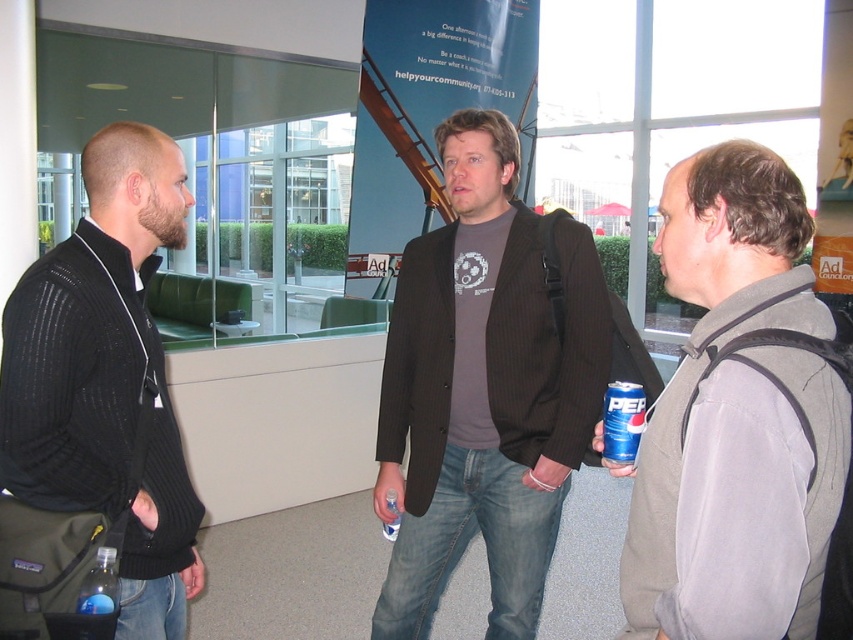
You are an observer in the scene. You notice the gray fleece vest at center and the dark brown pinstripe blazer at center. Which clothing item is positioned higher on the person?

The gray fleece vest at center is positioned higher than the dark brown pinstripe blazer at center.

You are a photographer trying to capture the blue metallic can at center right. You notice the gray fleece vest at center is blocking your view. Can you confirm if the vest is covering the can?

The gray fleece vest at center is positioned over the blue metallic can at center right, so yes, the vest is covering the can.

You are a photographer setting up a shoot in this scene. You need to ensure that the dark brown pinstripe blazer at center and the blue metallic can at center right are both in frame. Considering their sizes, which object should you prioritize framing first to ensure both are visible?

The dark brown pinstripe blazer at center is wider than the blue metallic can at center right, so prioritize framing the dark brown pinstripe blazer at center first to accommodate its larger size, ensuring both fit within the frame.